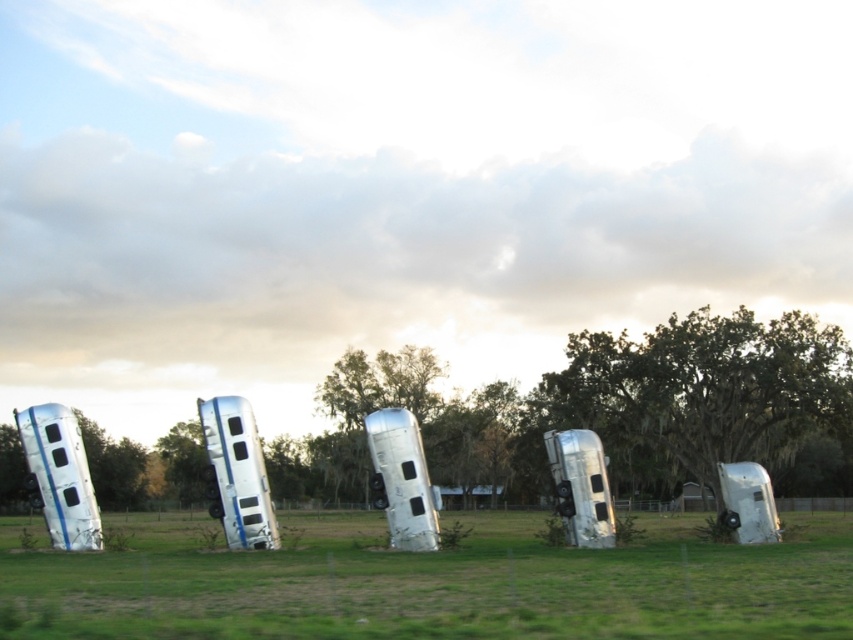
You are standing in the middle of the field looking at the silver metallic bus at center and the green leafy tree at center. Which object is positioned to the left side from your perspective?

The silver metallic bus at center is positioned to the left of the green leafy tree at center.

You are a photographer planning to capture a sunset shot with both the silver metallic bus at center and the green leafy tree at center in the frame. Which object should you position closer to the camera to ensure both are fully visible in the photo?

You should position the silver metallic bus at center closer to the camera because it is shorter than the green leafy tree at center, allowing both to be fully visible in the frame.

You are a photographer planning to take a wide shot of the silver metallic bus at center and the green leafy tree at center. Which object will appear bigger in the photo?

The silver metallic bus at center will appear bigger in the photo because it is larger in size than the green leafy tree at center.